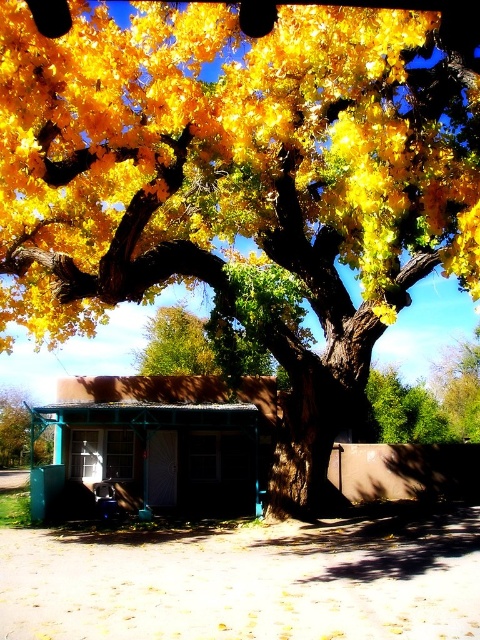
You are planning to move the green metallic pole at lower left to the location where the green painted wood hut at center is currently. Will the pole fit in the space if you move it there?

The green painted wood hut at center is wider than the green metallic pole at lower left. Since the pole is narrower, it will fit in the space where the hut is currently located.

You are standing at the entrance of the green painted wood hut at center and want to see the green metallic pole at lower left. Which direction should you face to see it?

Since the green painted wood hut at center is in front of the green metallic pole at lower left, you should face away from the hut to see the pole behind it.